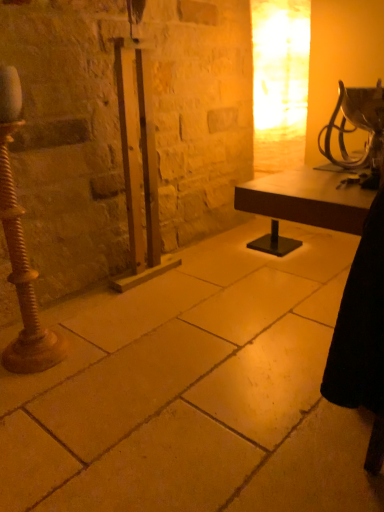
This screenshot has width=384, height=512. In order to click on vacant area that is in front of rusty metal pole at left in this screenshot , I will do tap(32, 389).